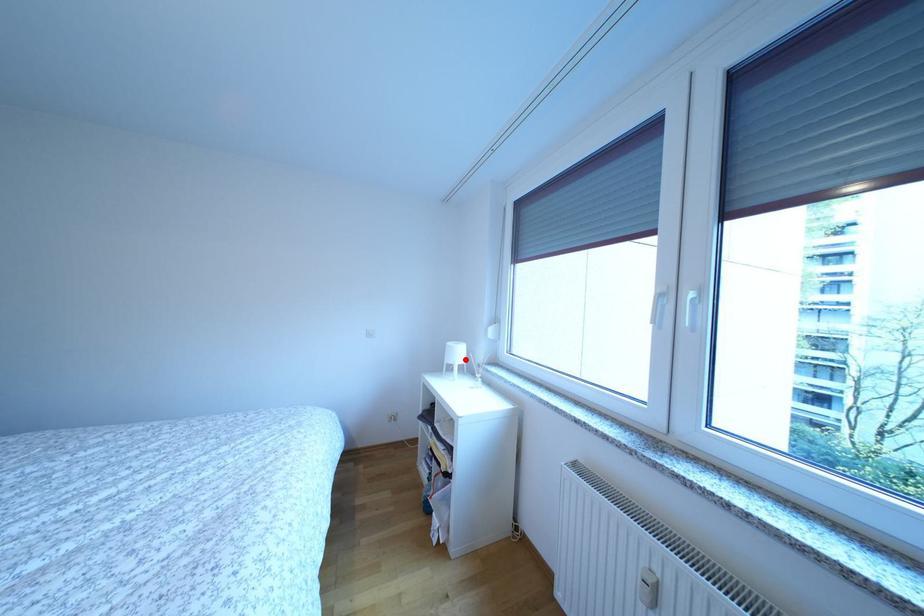
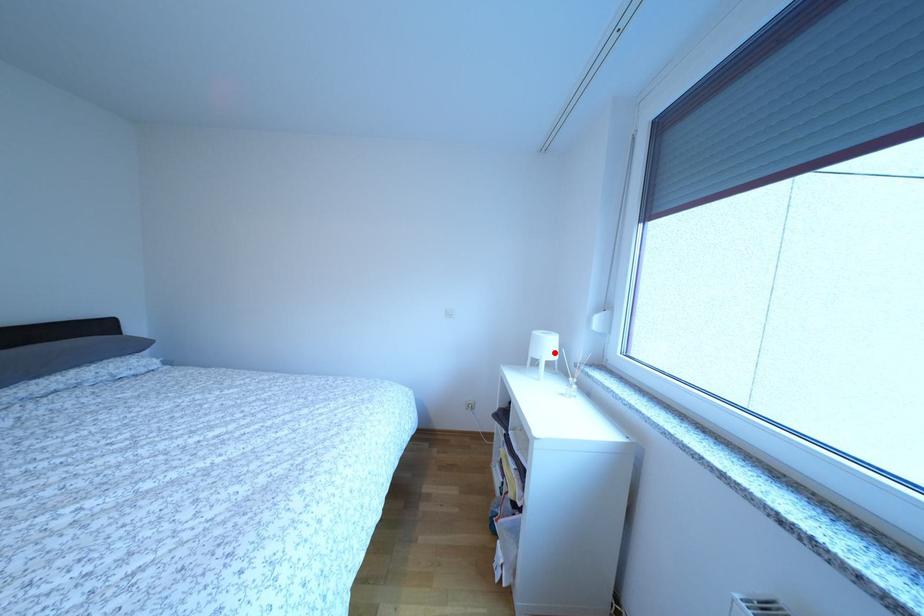
I am providing you with two images of the same scene from different viewpoints. A red point is marked on the first image and another point is marked on the second image. Do the highlighted points in image1 and image2 indicate the same real-world spot?

Yes